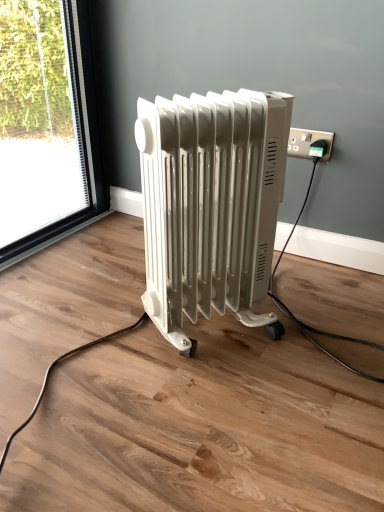
Where is `vacant space that is to the left of white glossy radiator at center`? vacant space that is to the left of white glossy radiator at center is located at coordinates (103, 336).